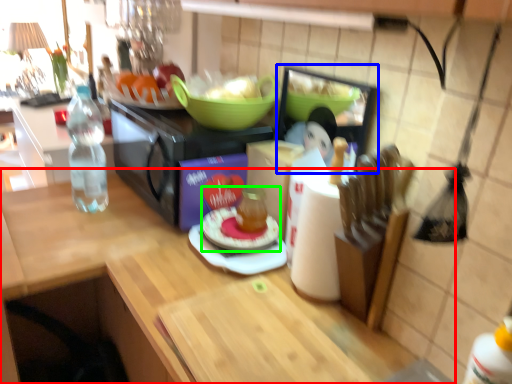
Question: Which object is positioned farthest from countertop (highlighted by a red box)? Select from appliance (highlighted by a blue box) and meal (highlighted by a green box).

Choices:
 (A) appliance
 (B) meal

Answer: (A)